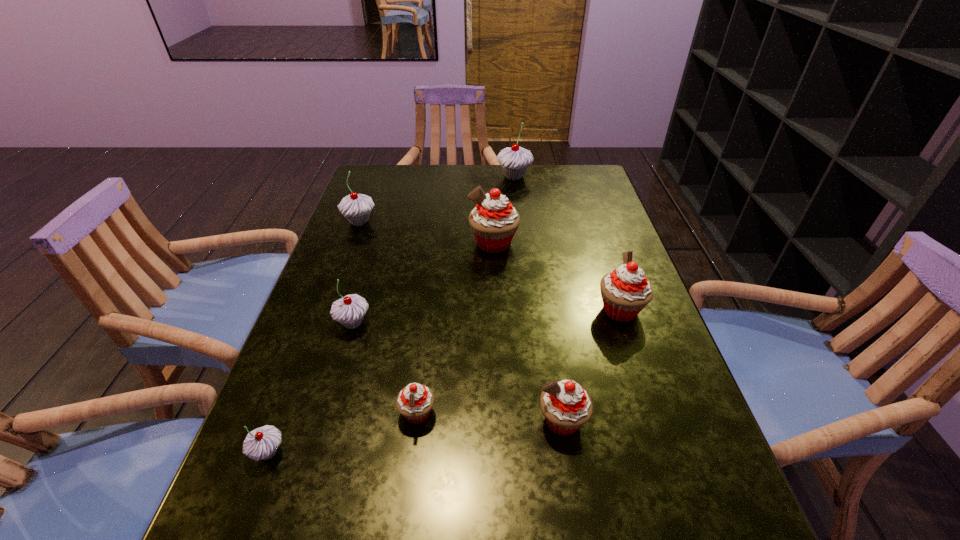
Where is `object that is at the right edge`? This screenshot has height=540, width=960. object that is at the right edge is located at coordinates (625, 292).

Identify the location of vacant space at the left edge. (378, 265).

In order to click on vacant region at the right edge of the desktop in this screenshot , I will do `click(604, 232)`.

The height and width of the screenshot is (540, 960). I want to click on vacant space at the far left corner of the desktop, so click(393, 198).

In order to click on free space between the second smallest pink cupcake and the second smallest gray cupcake in this screenshot , I will do `click(458, 372)`.

The height and width of the screenshot is (540, 960). Find the location of `vacant region between the biggest pink cupcake and the third nearest gray cupcake`. vacant region between the biggest pink cupcake and the third nearest gray cupcake is located at coordinates coord(426,232).

Locate an element on the screen. This screenshot has height=540, width=960. free space between the third nearest gray cupcake and the leftmost pink cupcake is located at coordinates (388, 318).

You are a GUI agent. You are given a task and a screenshot of the screen. Output one action in this format:
    pyautogui.click(x=<x>, y=<y>)
    Task: Click on the free area in between the second biggest gray cupcake and the rightmost cupcake
    The width and height of the screenshot is (960, 540).
    Given the screenshot: What is the action you would take?
    pyautogui.click(x=490, y=266)

I want to click on vacant region between the third biggest pink cupcake and the third biggest gray cupcake, so click(x=458, y=372).

I want to click on blank region between the leftmost pink cupcake and the farthest pink cupcake, so click(x=455, y=328).